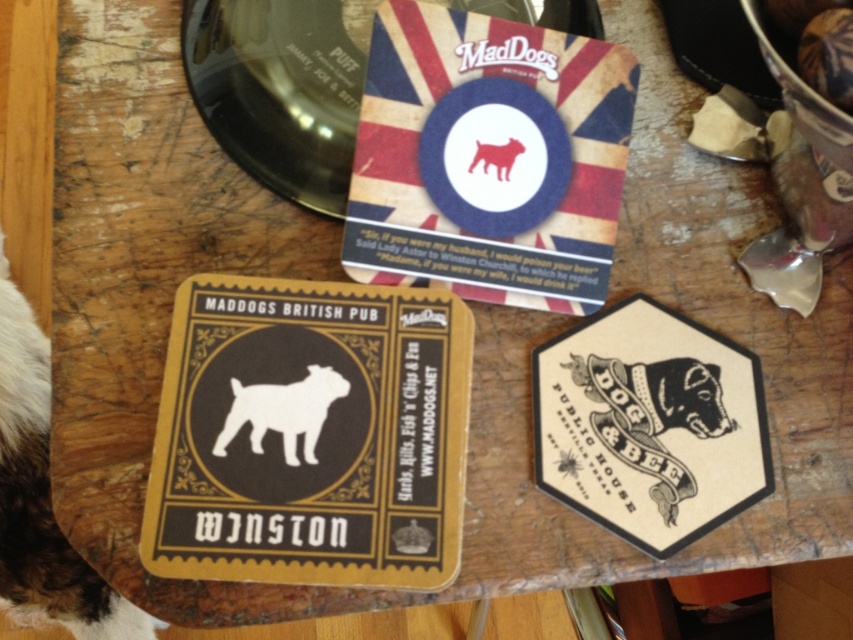
You are a customer at the MADDogs BRITISH PUB and want to place your drink on the coaster that has the Union Jack design. According to the image, where exactly is the matte black coaster at center located?

The matte black coaster at center is located at point (310, 435).

You are a customer at the British Pub and want to place a small teacup on the table without covering any text or symbols on the coasters. Considering the matte paper coaster at center and the white paper dog at center, which coaster should you choose to ensure the teacup doesn not obscure any important information?

The matte paper coaster at center is much taller than the white paper dog at center, so placing the teacup on the matte paper coaster at center would leave more space around it, reducing the chance of covering any text or symbols.